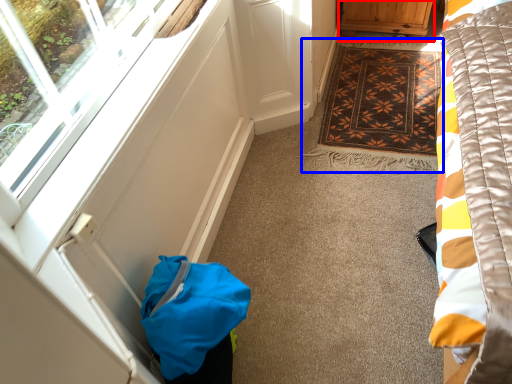
Question: Which object is closer to the camera taking this photo, furniture (highlighted by a red box) or mat (highlighted by a blue box)?

Choices:
 (A) furniture
 (B) mat

Answer: (B)